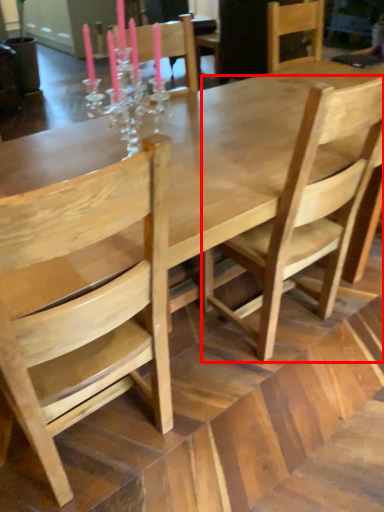
Question: In this image, where is chair (annotated by the red box) located relative to chair?

Choices:
 (A) left
 (B) right

Answer: (B)